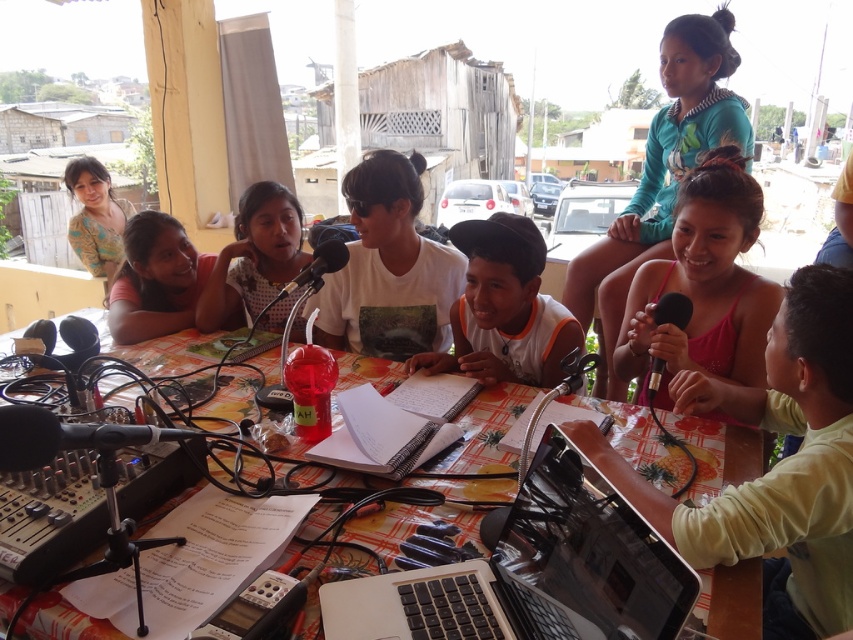
You are a photographer trying to capture a photo of the children in the scene. You want to ensure both the pink fabric dress at center and the printed fabric shirt at upper left are visible in the frame. Given their heights, which one might you need to adjust your camera angle to include in the shot?

The pink fabric dress at center is not as tall as the printed fabric shirt at upper left. Therefore, you might need to lower your camera angle slightly to ensure the shorter pink fabric dress at center is fully visible while still capturing the taller printed fabric shirt at upper left in the frame.

You are standing in front of the children recording their radio broadcast. There is a point marked at coordinates point [575,278]. If you want to place a small plant on the table so that it is exactly 2 meters away from you, will the plant be closer to or farther than the point?

The point [575,278] is 2.36 meters from the viewer. Since the desired distance for the plant is 2 meters, the plant would be closer to the viewer than the point.

You are a photographer positioned in front of the children. You need to capture a photo that includes both the pink fabric dress at center and the printed fabric shirt at upper left. Which of the two items should you focus on first to ensure both are in the frame?

The pink fabric dress at center is below the printed fabric shirt at upper left, so you should focus on the printed fabric shirt at upper left first to ensure both are in the frame.